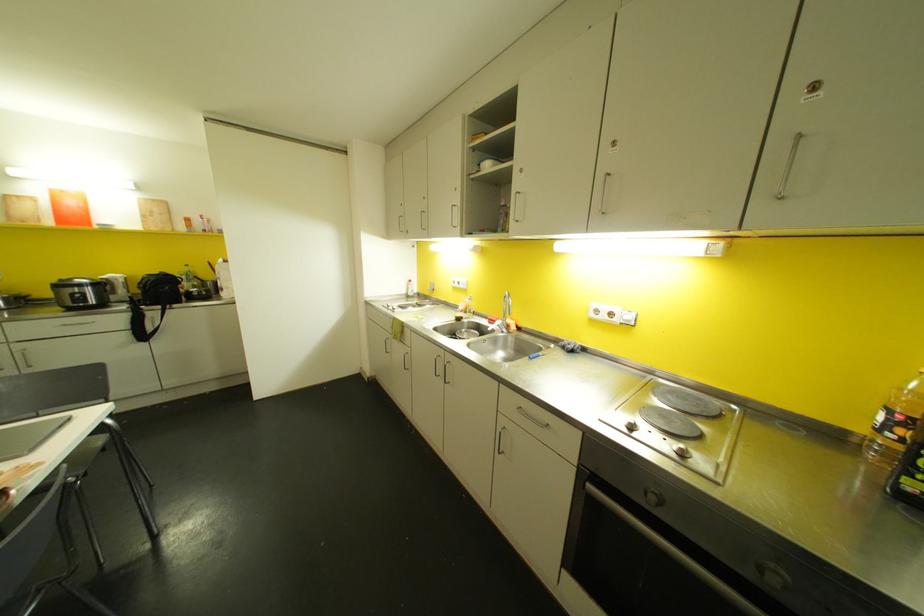
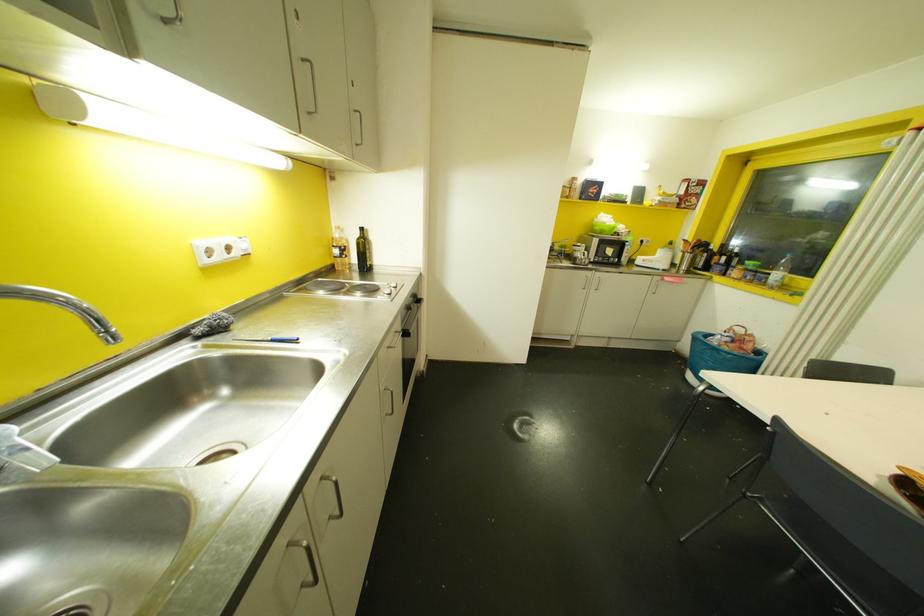
Where in the second image is the point corresponding to point (611, 314) from the first image?

(227, 248)